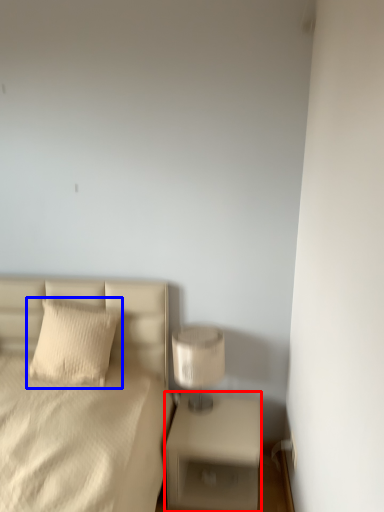
Question: Which object appears farthest to the camera in this image, nightstand (highlighted by a red box) or pillow (highlighted by a blue box)?

Choices:
 (A) nightstand
 (B) pillow

Answer: (B)